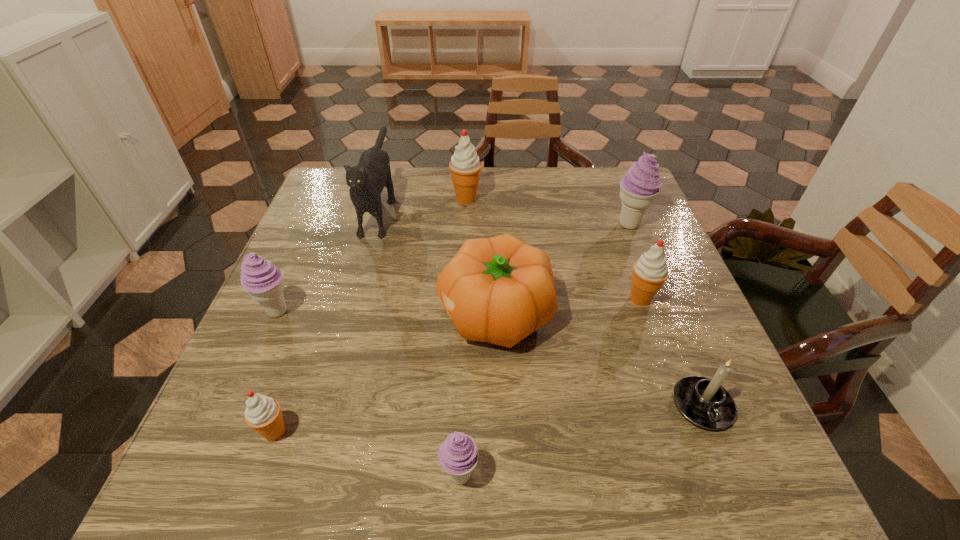
Locate an element on the screen. The image size is (960, 540). the second closest icecream relative to the second biggest red icecream is located at coordinates (465, 167).

You are a GUI agent. You are given a task and a screenshot of the screen. Output one action in this format:
    pyautogui.click(x=<x>, y=<y>)
    Task: Click on the icecream that stands as the second closest to the second smallest purple icecream
    This screenshot has height=540, width=960.
    Given the screenshot: What is the action you would take?
    pyautogui.click(x=458, y=455)

Point out which red icecream is positioned as the third nearest to the pumpkin. Please provide its 2D coordinates. Your answer should be formatted as a tuple, i.e. [(x, y)], where the tuple contains the x and y coordinates of a point satisfying the conditions above.

[(465, 167)]

Choose which red icecream is the second nearest neighbor to the farthest purple icecream. Please provide its 2D coordinates. Your answer should be formatted as a tuple, i.e. [(x, y)], where the tuple contains the x and y coordinates of a point satisfying the conditions above.

[(465, 167)]

Where is `purple icecream that is the second closest to the cat`? Image resolution: width=960 pixels, height=540 pixels. purple icecream that is the second closest to the cat is located at coordinates tap(458, 455).

Identify which purple icecream is located as the nearest to the cat. Please provide its 2D coordinates. Your answer should be formatted as a tuple, i.e. [(x, y)], where the tuple contains the x and y coordinates of a point satisfying the conditions above.

[(260, 278)]

This screenshot has width=960, height=540. I want to click on free region that satisfies the following two spatial constraints: 1. on the front-facing side of the cat; 2. on the right side of the rightmost red icecream, so pos(354,299).